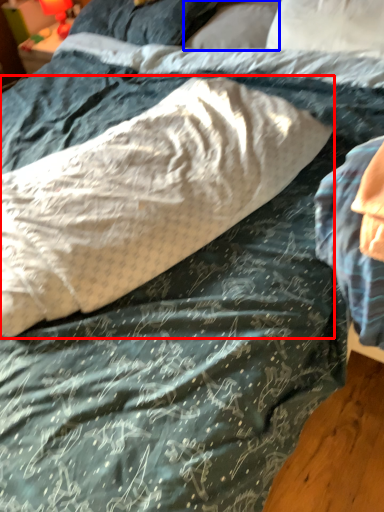
Question: Which point is further to the camera, pillow (highlighted by a red box) or pillow (highlighted by a blue box)?

Choices:
 (A) pillow
 (B) pillow

Answer: (B)